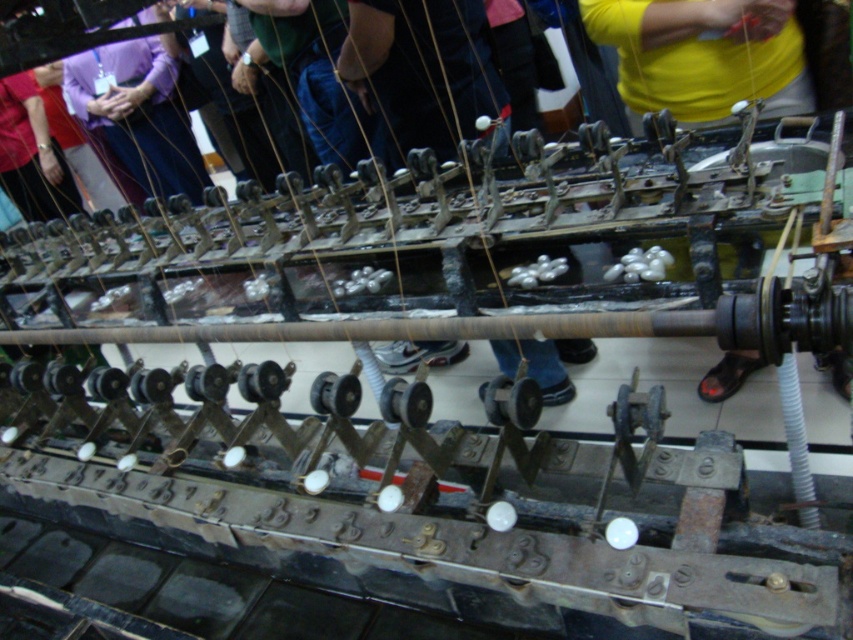
Consider the image. You are a quality control inspector checking the textile machine. You notice the yellow fabric at center and denim jeans at center. Which object is located below the other?

The yellow fabric at center is positioned under denim jeans at center, so the yellow fabric is below the denim jeans.

You are an industrial worker who needs to access the yellow cotton shirt at upper center and the denim jeans at center. According to the machine layout, which item is positioned lower in the machinery?

The yellow cotton shirt at upper center is located below denim jeans at center, so the yellow cotton shirt at upper center is positioned lower in the machinery.